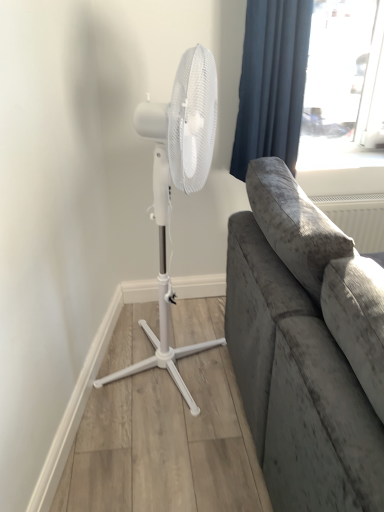
What do you see at coordinates (272, 82) in the screenshot? I see `blue velvet curtain at upper right` at bounding box center [272, 82].

At what (x,y) coordinates should I click in order to perform the action: click on blue velvet curtain at upper right. Please return your answer as a coordinate pair (x, y). Image resolution: width=384 pixels, height=512 pixels. Looking at the image, I should click on (272, 82).

The width and height of the screenshot is (384, 512). Find the location of `white plastic mechanical fan at left`. white plastic mechanical fan at left is located at coordinates (177, 187).

Describe the element at coordinates (177, 187) in the screenshot. I see `white plastic mechanical fan at left` at that location.

This screenshot has height=512, width=384. Identify the location of blue velvet curtain at upper right. (272, 82).

Considering the relative positions of white plastic mechanical fan at left and blue velvet curtain at upper right in the image provided, is white plastic mechanical fan at left to the left of blue velvet curtain at upper right from the viewer's perspective?

Yes.

Which object is closer to the camera taking this photo, white plastic mechanical fan at left or blue velvet curtain at upper right?

white plastic mechanical fan at left.

Between point (191, 160) and point (266, 64), which one is positioned behind?

The point (266, 64) is farther from the camera.

From the image's perspective, which is above, white plastic mechanical fan at left or blue velvet curtain at upper right?

blue velvet curtain at upper right is shown above in the image.

From a real-world perspective, is white plastic mechanical fan at left physically located above or below blue velvet curtain at upper right?

Clearly, from a real-world perspective, white plastic mechanical fan at left is below blue velvet curtain at upper right.

Between white plastic mechanical fan at left and blue velvet curtain at upper right, which one has larger width?

With larger width is white plastic mechanical fan at left.

Can you confirm if white plastic mechanical fan at left is taller than blue velvet curtain at upper right?

Indeed, white plastic mechanical fan at left has a greater height compared to blue velvet curtain at upper right.

Does white plastic mechanical fan at left have a larger size compared to blue velvet curtain at upper right?

Yes, white plastic mechanical fan at left is bigger than blue velvet curtain at upper right.

Is white plastic mechanical fan at left located outside blue velvet curtain at upper right?

That's correct, white plastic mechanical fan at left is outside of blue velvet curtain at upper right.

Is white plastic mechanical fan at left far away from blue velvet curtain at upper right?

They are positioned close to each other.

Is white plastic mechanical fan at left aimed at blue velvet curtain at upper right?

No, white plastic mechanical fan at left is not facing towards blue velvet curtain at upper right.

How many degrees apart are the facing directions of white plastic mechanical fan at left and blue velvet curtain at upper right?

There is a 69.6-degree angle between the facing directions of white plastic mechanical fan at left and blue velvet curtain at upper right.

Locate an element on the screen. mechanical fan directly beneath the blue velvet curtain at upper right (from a real-world perspective) is located at coordinates (177, 187).

Considering the relative positions of blue velvet curtain at upper right and white plastic mechanical fan at left in the image provided, is blue velvet curtain at upper right to the left or to the right of white plastic mechanical fan at left?

blue velvet curtain at upper right is positioned on white plastic mechanical fan at left's right side.

Is blue velvet curtain at upper right further to camera compared to white plastic mechanical fan at left?

Yes, the depth of blue velvet curtain at upper right is greater than that of white plastic mechanical fan at left.

Between point (297, 34) and point (203, 350), which one is positioned in front?

The point (297, 34) is closer to the camera.

From the image's perspective, is blue velvet curtain at upper right below white plastic mechanical fan at left?

Incorrect, from the image's perspective, blue velvet curtain at upper right is higher than white plastic mechanical fan at left.

In the scene shown: From a real-world perspective, which is physically below, blue velvet curtain at upper right or white plastic mechanical fan at left?

From a 3D spatial view, white plastic mechanical fan at left is below.

Which object is thinner, blue velvet curtain at upper right or white plastic mechanical fan at left?

With smaller width is blue velvet curtain at upper right.

Is blue velvet curtain at upper right taller or shorter than white plastic mechanical fan at left?

In the image, blue velvet curtain at upper right appears to be shorter than white plastic mechanical fan at left.

Is blue velvet curtain at upper right smaller than white plastic mechanical fan at left?

Yes.

Could white plastic mechanical fan at left be considered to be inside blue velvet curtain at upper right?

No, white plastic mechanical fan at left is located outside of blue velvet curtain at upper right.

Are blue velvet curtain at upper right and white plastic mechanical fan at left beside each other?

They are not placed beside each other.

Could you tell me if blue velvet curtain at upper right is turned towards white plastic mechanical fan at left?

No, blue velvet curtain at upper right is not aimed at white plastic mechanical fan at left.

Where is `mechanical fan to the left of blue velvet curtain at upper right`? mechanical fan to the left of blue velvet curtain at upper right is located at coordinates (177, 187).

Locate an element on the screen. Image resolution: width=384 pixels, height=512 pixels. mechanical fan on the left of the blue velvet curtain at upper right is located at coordinates (177, 187).

Image resolution: width=384 pixels, height=512 pixels. Identify the location of mechanical fan below the blue velvet curtain at upper right (from a real-world perspective). (177, 187).